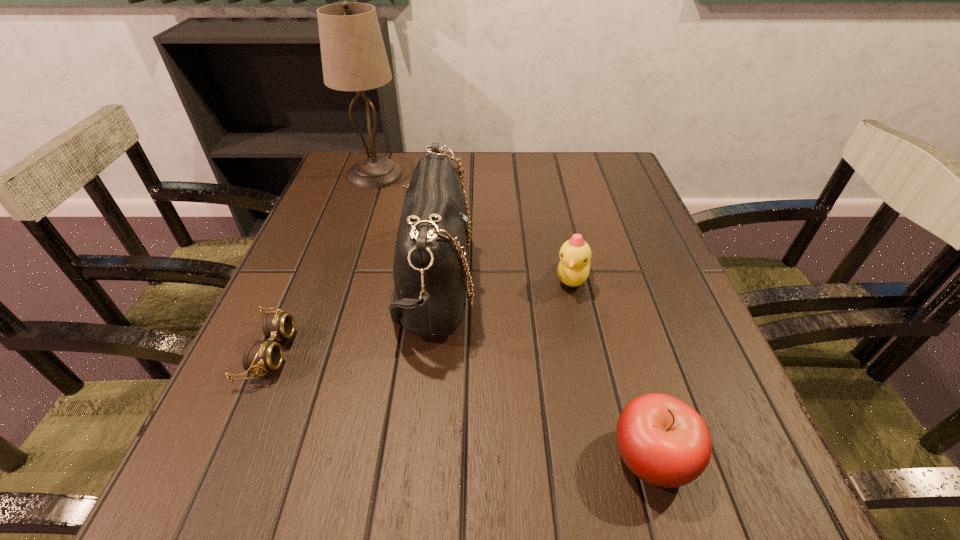
This screenshot has height=540, width=960. I want to click on free space that satisfies the following two spatial constraints: 1. on the back side of the nearest object; 2. through the lenses of the goggles, so click(621, 352).

You are a GUI agent. You are given a task and a screenshot of the screen. Output one action in this format:
    pyautogui.click(x=<x>, y=<y>)
    Task: Click on the free point that satisfies the following two spatial constraints: 1. through the lenses of the nearest object; 2. on the left side of the goggles
    The image size is (960, 540).
    Given the screenshot: What is the action you would take?
    pyautogui.click(x=225, y=457)